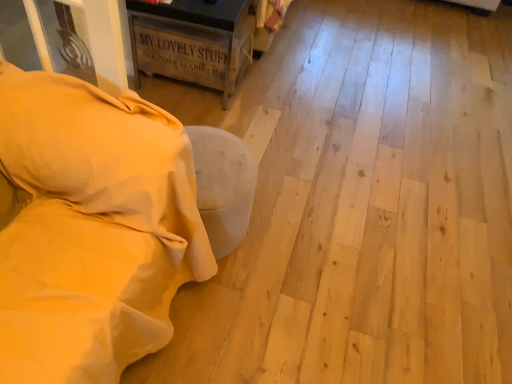
Question: Is point (118, 160) positioned closer to the camera than point (121, 304)?

Choices:
 (A) farther
 (B) closer

Answer: (A)

Question: Is beige soft pillow at left spatially inside beige fabric ottoman at lower left, the first furniture in the front-to-back sequence, or outside of it?

Choices:
 (A) outside
 (B) inside

Answer: (A)

Question: Estimate the real-world distances between objects in this image. Which object is farther from the beige fabric ottoman at lower left, the first furniture in the front-to-back sequence?

Choices:
 (A) beige soft pillow at left
 (B) rustic wood crate at upper left, which is the 2th furniture from bottom to top

Answer: (B)

Question: Which object is positioned farthest from the rustic wood crate at upper left, which is the 2th furniture from bottom to top?

Choices:
 (A) beige soft pillow at left
 (B) beige fabric ottoman at lower left, the first furniture in the front-to-back sequence

Answer: (B)